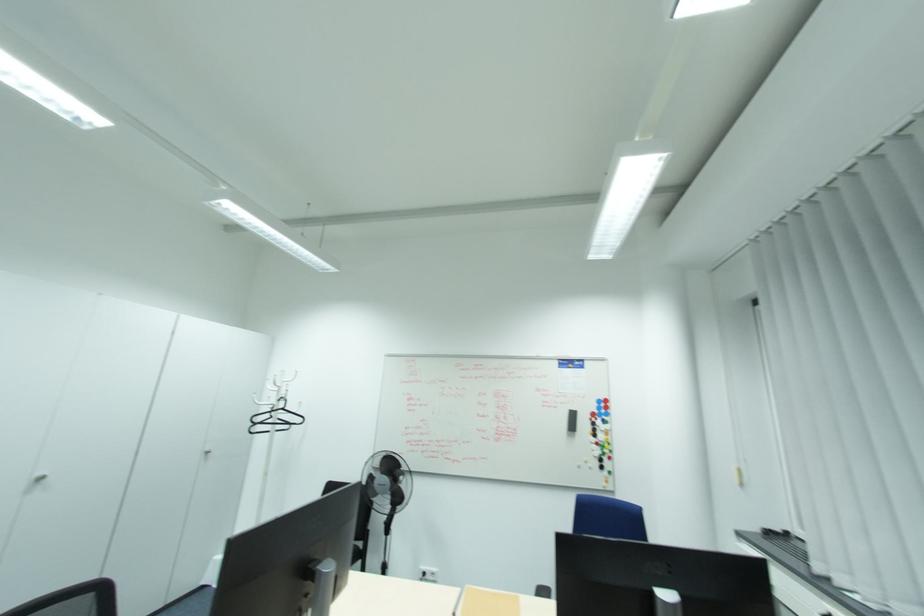
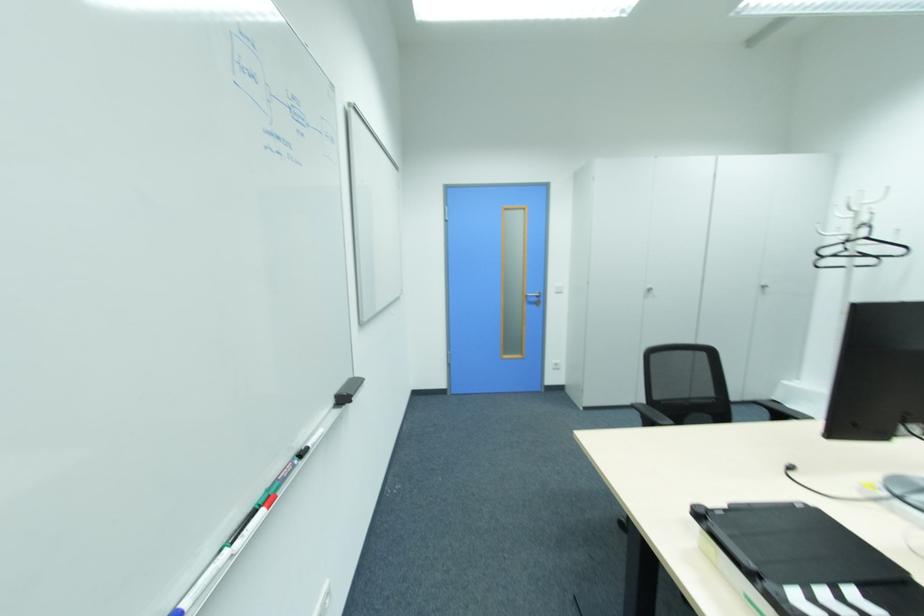
Locate, in the second image, the point that corresponds to (42,475) in the first image.

(650, 288)